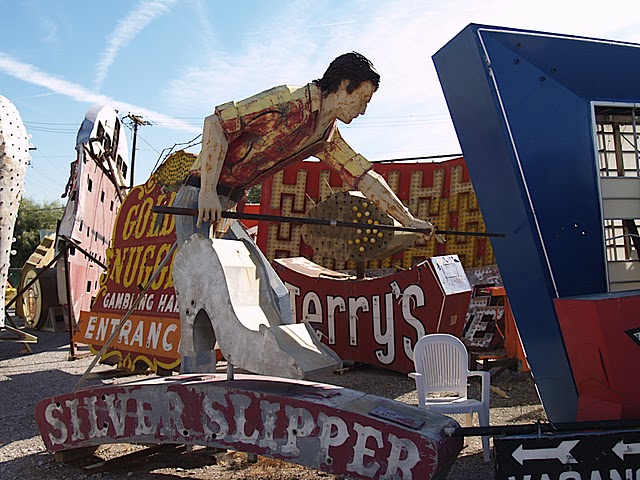
Where is `prop`? The image size is (640, 480). prop is located at coordinates (91, 232).